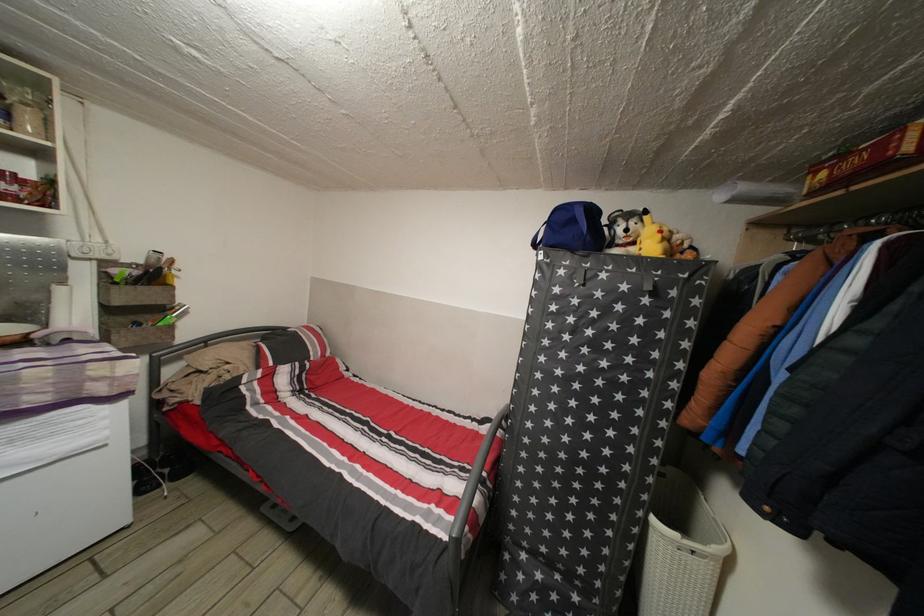
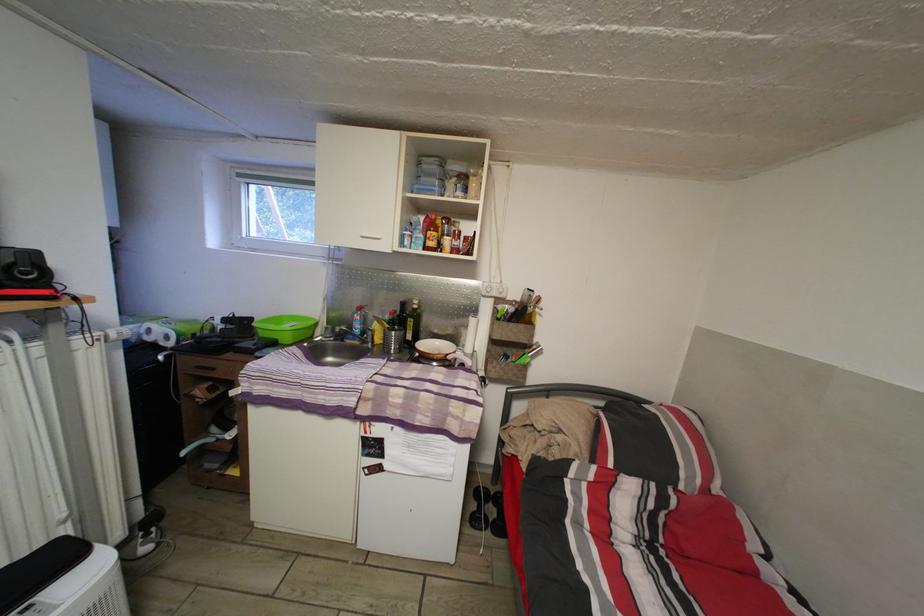
Find the pixel in the second image that matches pixel 156 468 in the first image.

(493, 498)